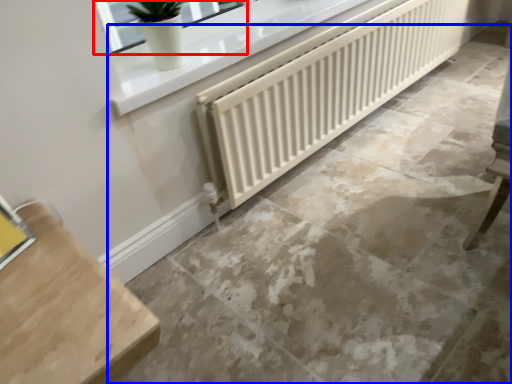
Question: Which of the following is the closest to the observer, window (highlighted by a red box) or concrete (highlighted by a blue box)?

Choices:
 (A) window
 (B) concrete

Answer: (B)